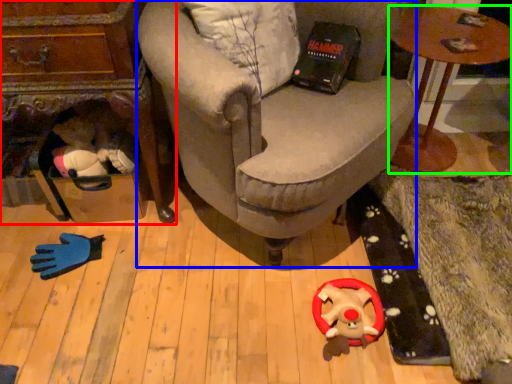
Question: Based on their relative distances, which object is farther from table (highlighted by a red box)? Choose from chair (highlighted by a blue box) and table (highlighted by a green box).

Choices:
 (A) chair
 (B) table

Answer: (B)